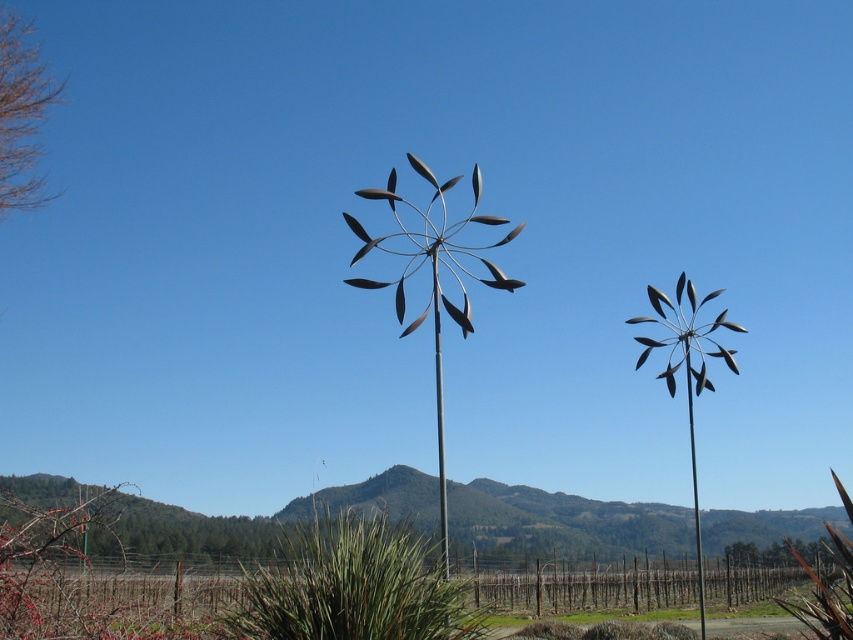
Between metallic silver windmill at right and metallic pole at center, which one has more height?

metallic pole at center

Is metallic silver windmill at right to the left of metallic pole at center from the viewer's perspective?

No, metallic silver windmill at right is not to the left of metallic pole at center.

Which is in front, point (682, 317) or point (432, 280)?

Positioned in front is point (432, 280).

Locate an element on the screen. This screenshot has height=640, width=853. metallic silver windmill at right is located at coordinates (685, 336).

Is metallic silver windmill at center shorter than metallic silver windmill at right?

Correct, metallic silver windmill at center is not as tall as metallic silver windmill at right.

Does metallic silver windmill at center appear on the right side of metallic silver windmill at right?

No, metallic silver windmill at center is not to the right of metallic silver windmill at right.

You are a GUI agent. You are given a task and a screenshot of the screen. Output one action in this format:
    pyautogui.click(x=<x>, y=<y>)
    Task: Click on the metallic silver windmill at center
    
    Given the screenshot: What is the action you would take?
    pyautogui.click(x=432, y=243)

Is metallic silver windmill at center bigger than metallic pole at center?

No.

Who is positioned more to the left, metallic silver windmill at center or metallic pole at center?

metallic pole at center is more to the left.

Is point (512, 289) positioned before point (432, 260)?

Yes, it is in front of point (432, 260).

At what (x,y) coordinates should I click in order to perform the action: click on metallic silver windmill at center. Please return your answer as a coordinate pair (x, y). The height and width of the screenshot is (640, 853). Looking at the image, I should click on (432, 243).